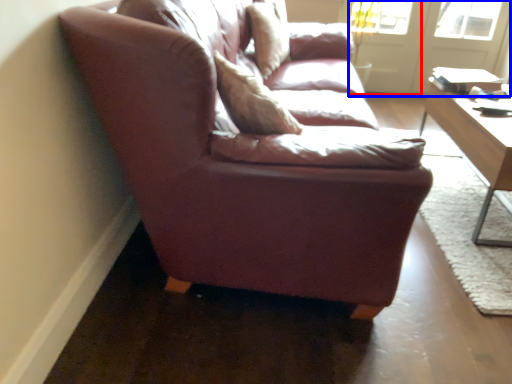
Question: Which point is further to the camera, screen door (highlighted by a red box) or screen door (highlighted by a blue box)?

Choices:
 (A) screen door
 (B) screen door

Answer: (A)